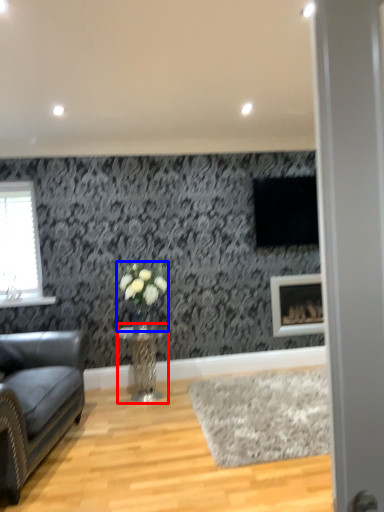
Question: Among these objects, which one is farthest to the camera, table (highlighted by a red box) or floral arrangement (highlighted by a blue box)?

Choices:
 (A) table
 (B) floral arrangement

Answer: (B)